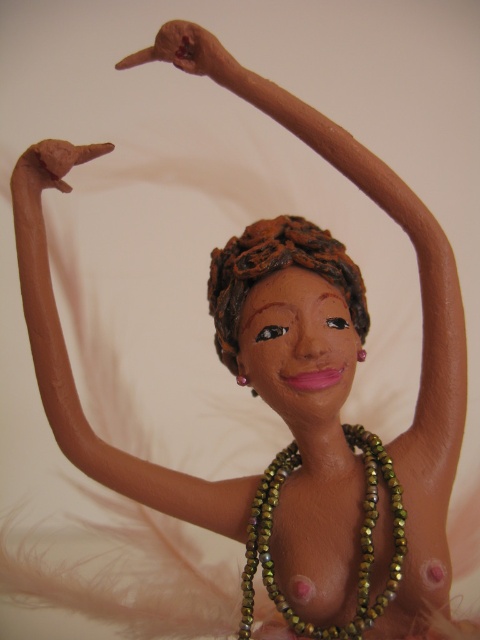
Question: In this image, where is green beaded necklace at center located relative to brown clay hair at center?

Choices:
 (A) above
 (B) below

Answer: (B)

Question: Among these points, which one is nearest to the camera?

Choices:
 (A) (216, 307)
 (B) (38, 298)
 (C) (397, 490)

Answer: (C)

Question: In this image, where is green beaded necklace at center located relative to brown clay hair at center?

Choices:
 (A) below
 (B) above

Answer: (A)

Question: Which point is farther from the camera taking this photo?

Choices:
 (A) (205, 516)
 (B) (402, 504)

Answer: (A)

Question: Estimate the real-world distances between objects in this image. Which object is closer to the matte clay arm at upper center?

Choices:
 (A) brown clay hair at center
 (B) green beaded necklace at center

Answer: (B)

Question: Can you confirm if matte clay arm at upper center is positioned to the right of brown clay hair at center?

Choices:
 (A) yes
 (B) no

Answer: (B)